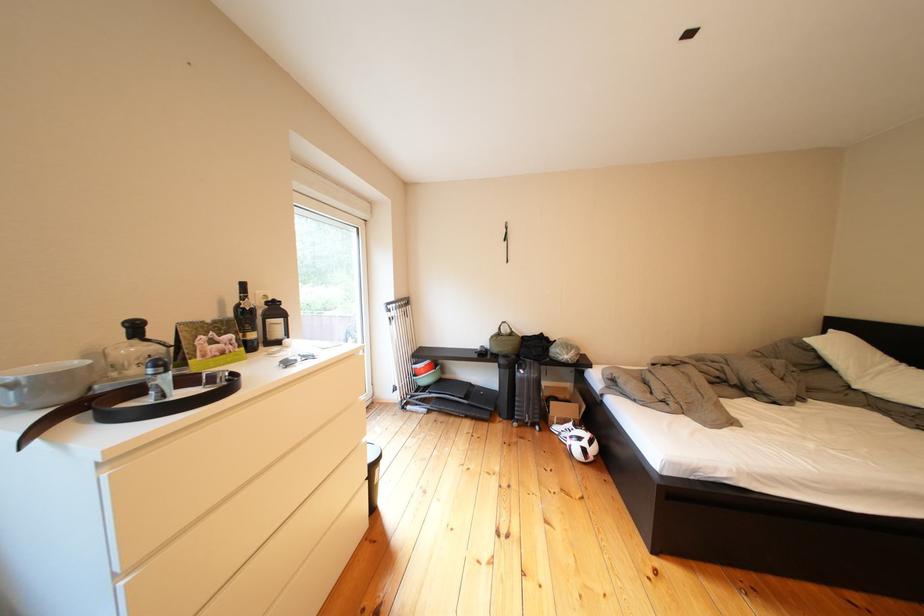
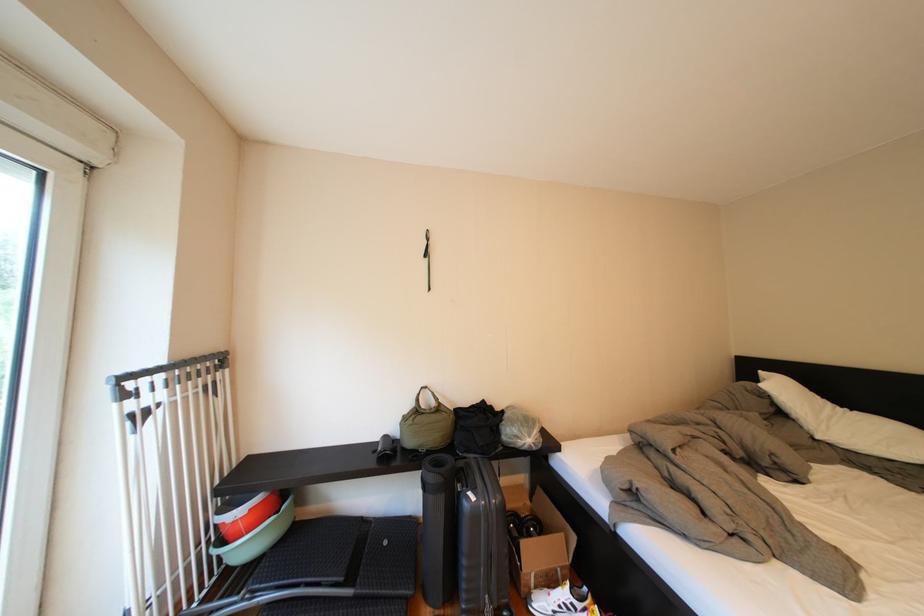
Locate, in the second image, the point that corresponds to the point at 565,408 in the first image.

(538, 548)